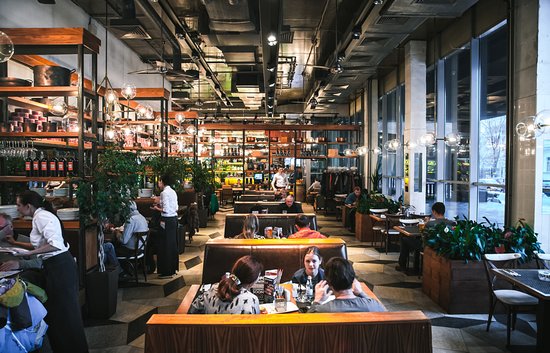
This screenshot has height=353, width=550. Identify the location of wine bottles with red label. (27, 166), (36, 165), (43, 164), (52, 166), (60, 166), (70, 166).